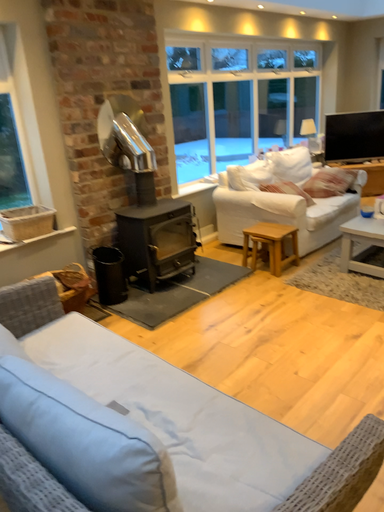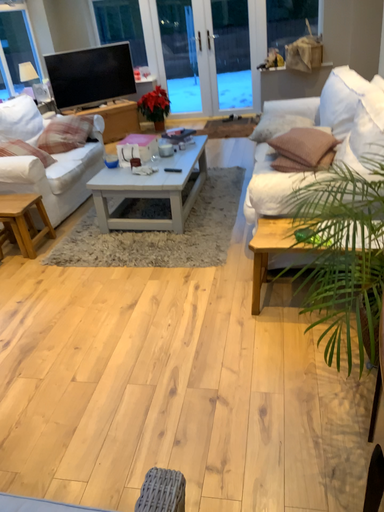
Question: Which way did the camera rotate in the video?

Choices:
 (A) rotated left
 (B) rotated right

Answer: (B)